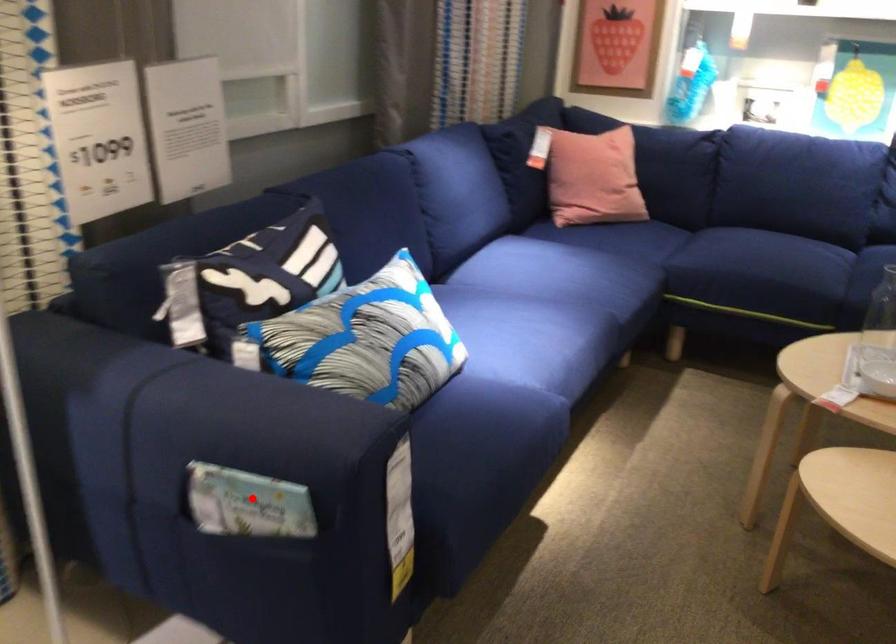
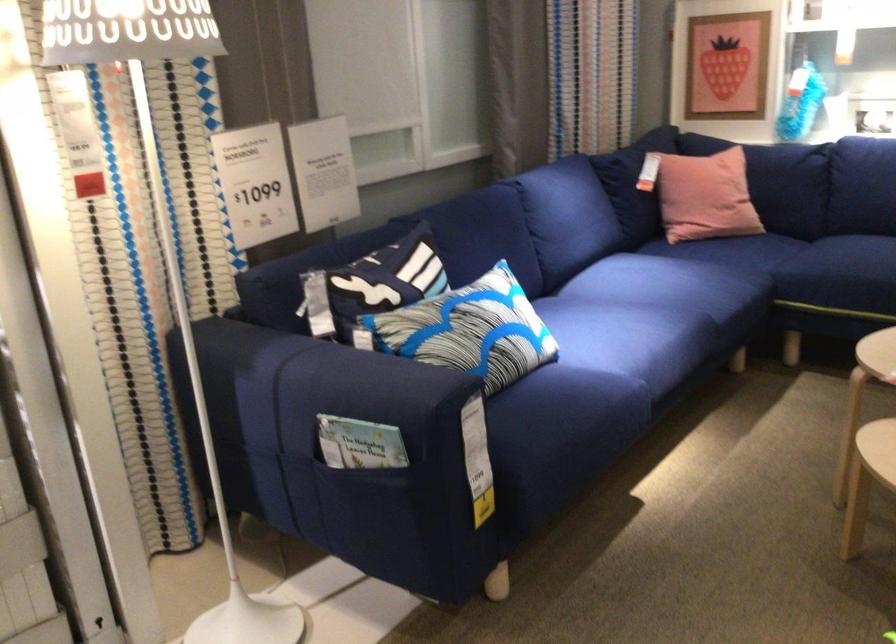
Locate, in the second image, the point that corresponds to the highlighted location in the first image.

(359, 444)